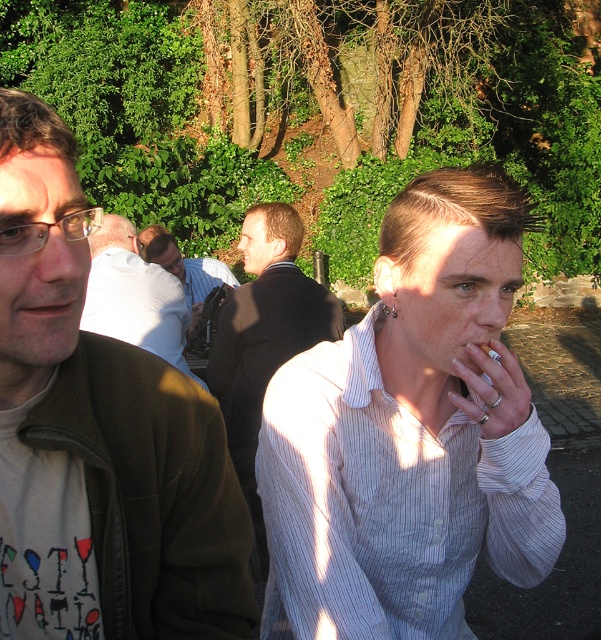
Question: Among these objects, which one is farthest from the camera?

Choices:
 (A) dark brown leather jacket at center
 (B) matte brown jacket at left
 (C) white striped shirt at center

Answer: (A)

Question: In this image, where is white striped shirt at center located relative to matte brown jacket at left?

Choices:
 (A) below
 (B) above

Answer: (A)

Question: Which is nearer to the matte brown jacket at left?

Choices:
 (A) white striped shirt at center
 (B) white shirt at center

Answer: (A)

Question: Estimate the real-world distances between objects in this image. Which object is farther from the dark brown leather jacket at center?

Choices:
 (A) white striped shirt at center
 (B) white shirt at center

Answer: (A)

Question: Does matte brown jacket at left appear under white shirt at center?

Choices:
 (A) no
 (B) yes

Answer: (B)

Question: Can you confirm if white shirt at center is smaller than dark brown leather jacket at center?

Choices:
 (A) no
 (B) yes

Answer: (B)